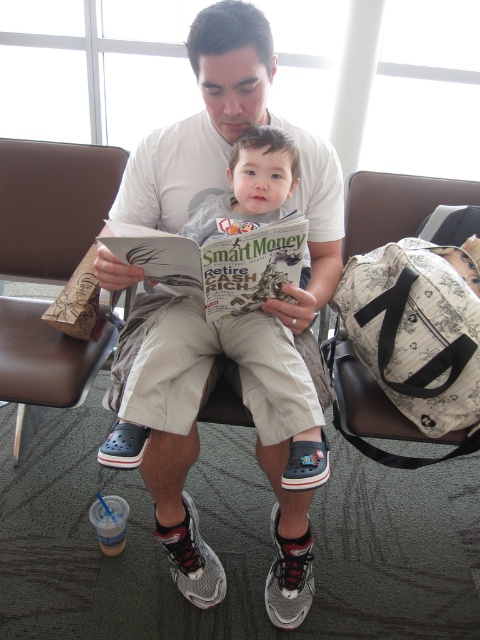
Can you confirm if gray cotton shirt at center is bigger than patterned fabric bag at right?

Indeed, gray cotton shirt at center has a larger size compared to patterned fabric bag at right.

Measure the distance between point (300, 618) and camera.

They are 4.59 feet apart.

Is point (124, 380) less distant than point (349, 392)?

Yes, point (124, 380) is in front of point (349, 392).

Identify the location of gray cotton shirt at center. This screenshot has height=640, width=480. [x=197, y=438].

Is gray cotton shirt at center below brown leather armchair at left?

Yes.

Who is lower down, gray cotton shirt at center or brown leather armchair at left?

gray cotton shirt at center is below.

Image resolution: width=480 pixels, height=640 pixels. I want to click on gray cotton shirt at center, so click(x=197, y=438).

At what (x,y) coordinates should I click in order to perform the action: click on brown leather armchair at left. Please return your answer as a coordinate pair (x, y). This screenshot has width=480, height=640. Looking at the image, I should click on (52, 205).